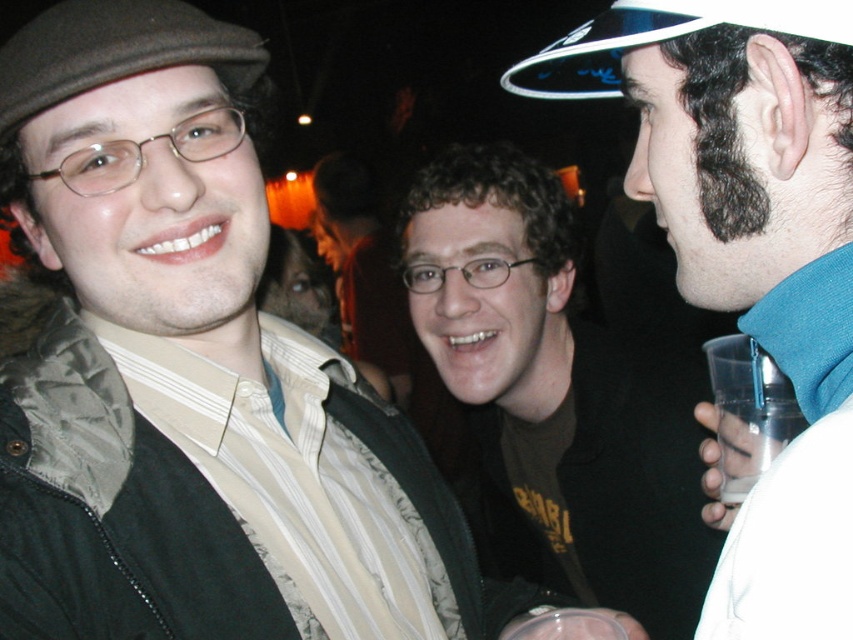
You are organizing a photo shoot and need to arrange two props based on their widths. You have a matte black jacket at left and a brown felt hat at upper left from the image. If you want to place them side by side on a shelf, which one should you place on the left to ensure they fit without overlapping?

The matte black jacket at left might be wider than the brown felt hat at upper left, so placing the wider matte black jacket at left on the left side would allow them to fit side by side without overlapping.

You are a photographer at the event and want to capture a photo where the blue fabric shirt at right and the brown felt hat at upper left are both visible. Based on their sizes in the image, which object will appear taller in the final photo?

The blue fabric shirt at right will appear taller in the photo since it has a greater height compared to the brown felt hat at upper left according to the description.